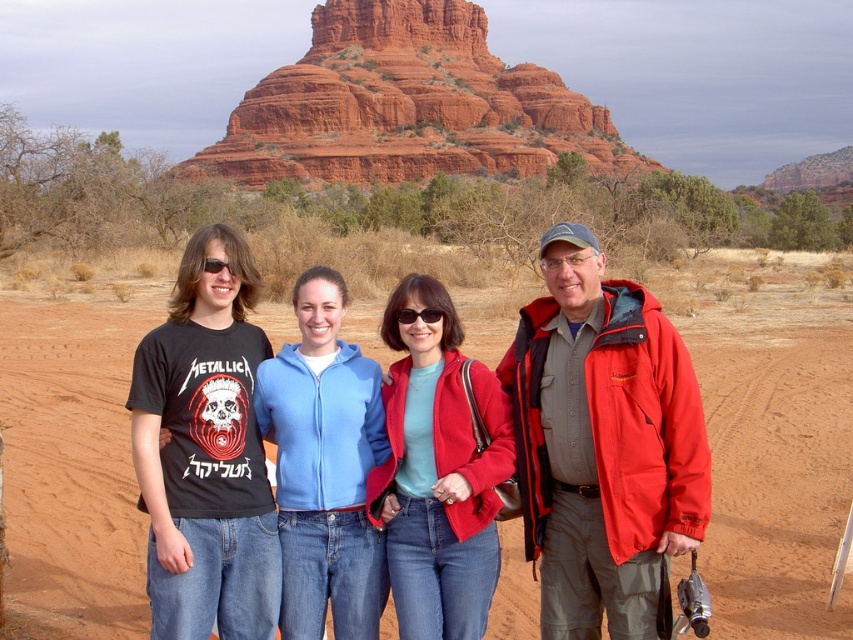
Question: Which of the following is the farthest from the observer?

Choices:
 (A) (306, 586)
 (B) (270, 83)
 (C) (447, 589)

Answer: (B)

Question: Is the position of matte black t-shirt at left less distant than that of blue fleece jacket at center?

Choices:
 (A) no
 (B) yes

Answer: (B)

Question: Which is farther from the matte black t-shirt at left?

Choices:
 (A) reddish-brown sandstone rock formation at upper center
 (B) red matte jacket at center
 (C) blue fleece jacket at center
 (D) black matte t-shirt at left

Answer: (A)

Question: Considering the relative positions of matte black t-shirt at left and red matte jacket at center in the image provided, where is matte black t-shirt at left located with respect to red matte jacket at center?

Choices:
 (A) right
 (B) left

Answer: (B)

Question: Does reddish-brown sandstone rock formation at upper center appear on the right side of matte red jacket at center?

Choices:
 (A) no
 (B) yes

Answer: (A)

Question: Estimate the real-world distances between objects in this image. Which object is closer to the blue fleece jacket at center?

Choices:
 (A) matte red jacket at center
 (B) matte black t-shirt at left
 (C) red matte jacket at center

Answer: (A)